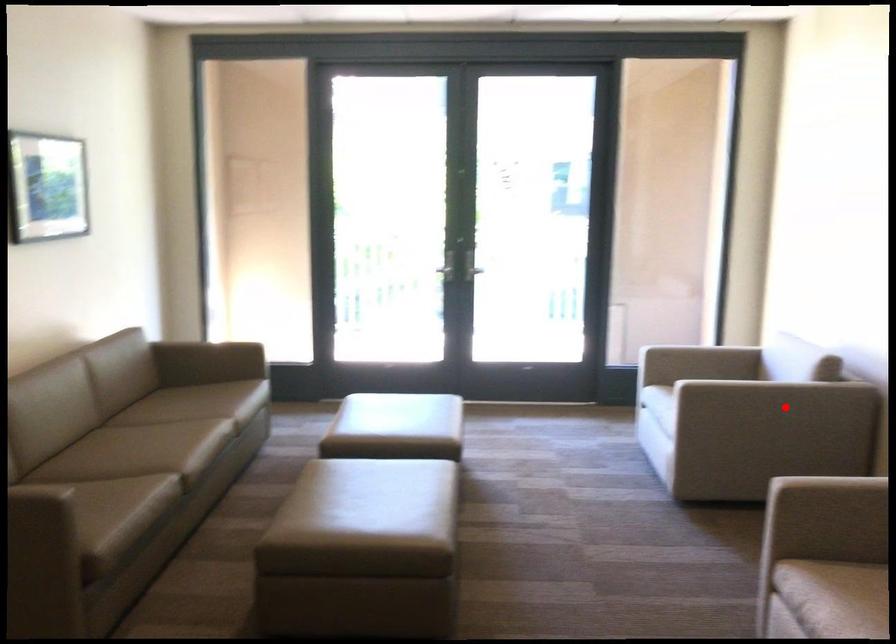
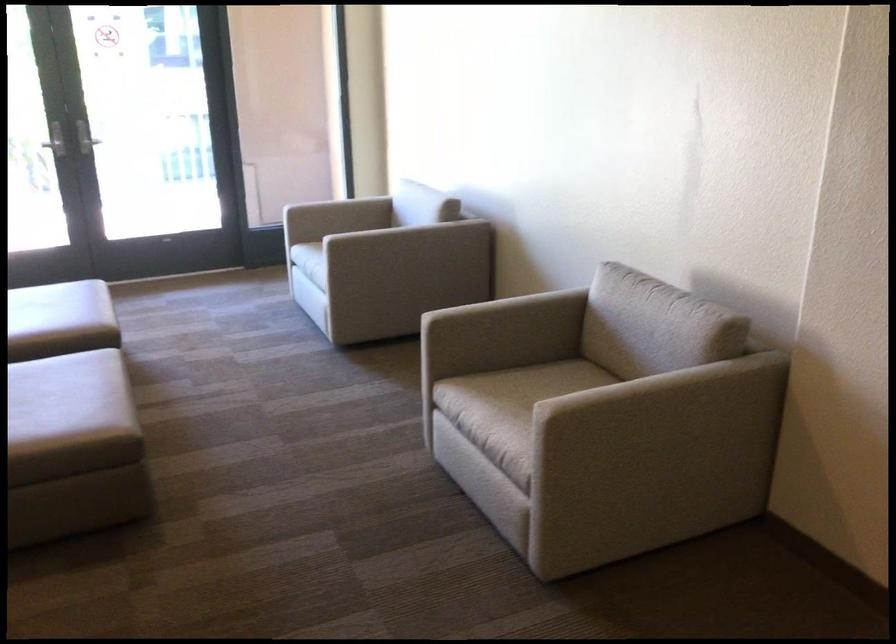
In the second image, find the point that corresponds to the highlighted location in the first image.

(417, 242)